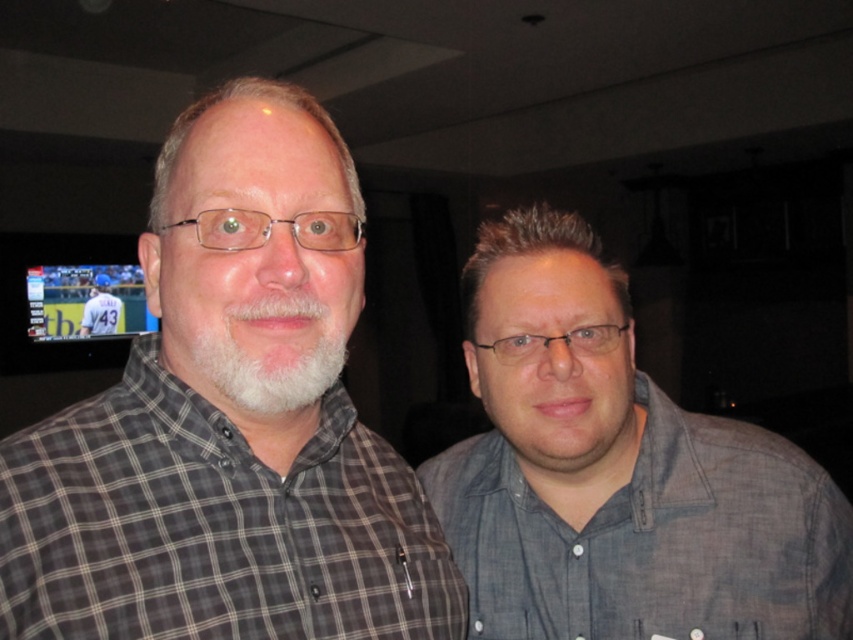
Question: Which object is the farthest from the plaid cotton shirt at left?

Choices:
 (A) gray cotton shirt at right
 (B) gray checkered shirt at center

Answer: (B)

Question: From the image, what is the correct spatial relationship of plaid cotton shirt at left in relation to gray checkered shirt at center?

Choices:
 (A) left
 (B) right

Answer: (B)

Question: Which object is the closest to the plaid cotton shirt at left?

Choices:
 (A) gray checkered shirt at center
 (B) gray cotton shirt at right

Answer: (B)

Question: Is plaid cotton shirt at left closer to the viewer compared to gray cotton shirt at right?

Choices:
 (A) yes
 (B) no

Answer: (A)

Question: Estimate the real-world distances between objects in this image. Which object is farther from the gray checkered shirt at center?

Choices:
 (A) plaid cotton shirt at left
 (B) gray cotton shirt at right

Answer: (A)

Question: Is plaid cotton shirt at left thinner than gray cotton shirt at right?

Choices:
 (A) no
 (B) yes

Answer: (B)